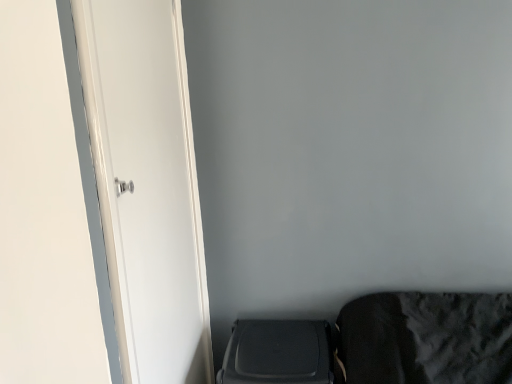
Question: Considering the relative positions of black matte suitcase at lower right and white glossy door at left in the image provided, is black matte suitcase at lower right to the left or to the right of white glossy door at left?

Choices:
 (A) left
 (B) right

Answer: (B)

Question: Looking at their shapes, would you say black matte suitcase at lower right is wider or thinner than white glossy door at left?

Choices:
 (A) wide
 (B) thin

Answer: (A)

Question: From the image's perspective, is black matte suitcase at lower right positioned above or below white glossy door at left?

Choices:
 (A) below
 (B) above

Answer: (A)

Question: From a real-world perspective, is white glossy door at left positioned above or below black matte suitcase at lower right?

Choices:
 (A) below
 (B) above

Answer: (B)

Question: From the image's perspective, is white glossy door at left located above or below black matte suitcase at lower right?

Choices:
 (A) above
 (B) below

Answer: (A)

Question: Is point (138, 360) closer or farther from the camera than point (267, 354)?

Choices:
 (A) closer
 (B) farther

Answer: (A)

Question: Is white glossy door at left wider or thinner than black matte suitcase at lower right?

Choices:
 (A) wide
 (B) thin

Answer: (B)